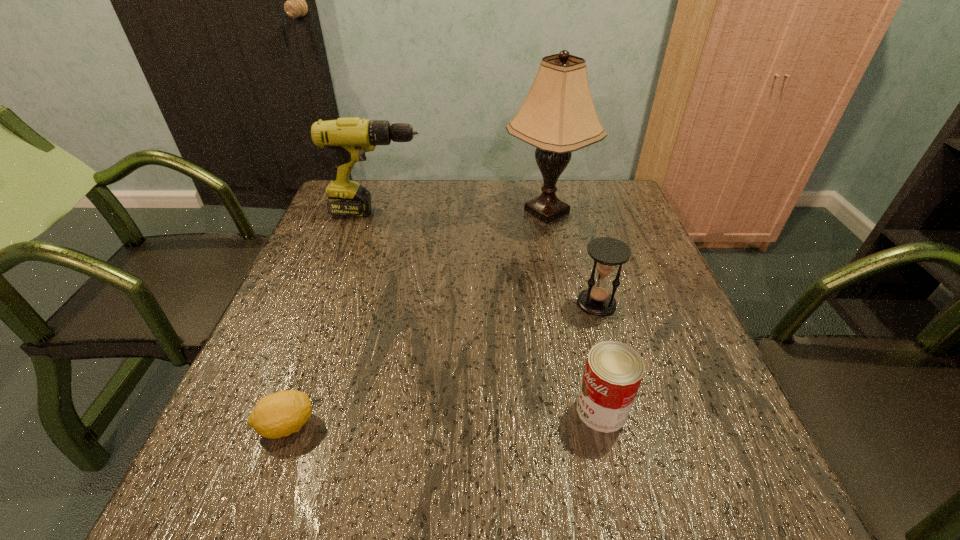
At what (x,y) coordinates should I click in order to perform the action: click on vacant space located 0.070m on the front label of the can. Please return your answer as a coordinate pair (x, y). Looking at the image, I should click on (538, 410).

Find the location of a particular element. This screenshot has height=540, width=960. free spot located at the stem end of the lemon is located at coordinates (425, 426).

Find the location of a particular element. The width and height of the screenshot is (960, 540). lamp that is at the far edge is located at coordinates (558, 116).

I want to click on drill that is at the far edge, so click(349, 138).

The image size is (960, 540). In order to click on drill present at the left edge in this screenshot , I will do click(349, 138).

Where is `lemon that is positioned at the left edge`? The width and height of the screenshot is (960, 540). lemon that is positioned at the left edge is located at coordinates (280, 414).

Where is `lamp that is at the right edge`? The width and height of the screenshot is (960, 540). lamp that is at the right edge is located at coordinates (558, 116).

Identify the location of hourglass present at the right edge. (607, 253).

Identify the location of object at the far left corner. This screenshot has height=540, width=960. (349, 138).

Locate an element on the screen. This screenshot has width=960, height=540. object at the far right corner is located at coordinates (558, 116).